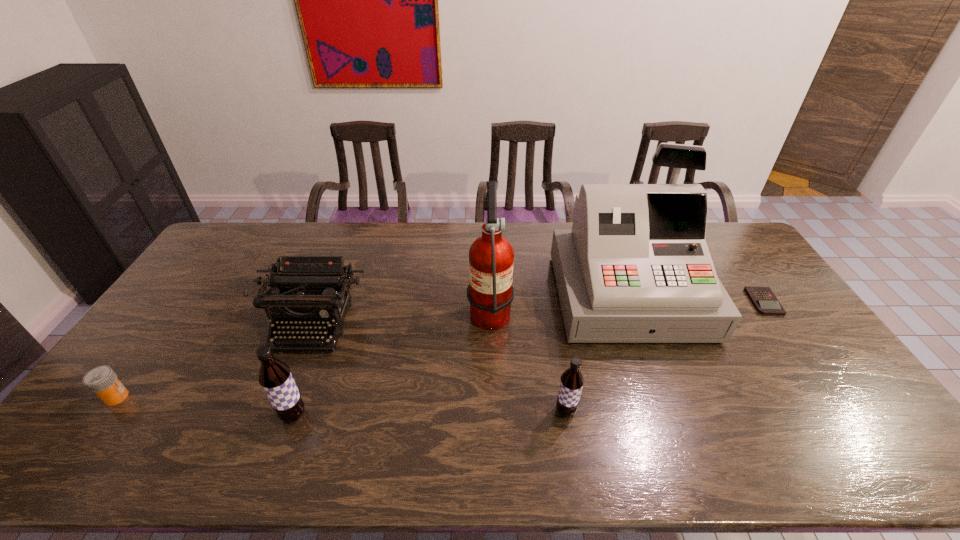
Locate an element on the screen. The height and width of the screenshot is (540, 960). object that stands as the fifth closest to the sixth object from left to right is located at coordinates (275, 377).

Identify which object is located as the nearest to the taller root beer. Please provide its 2D coordinates. Your answer should be formatted as a tuple, i.e. [(x, y)], where the tuple contains the x and y coordinates of a point satisfying the conditions above.

[(321, 283)]

Locate an element on the screen. This screenshot has height=540, width=960. vacant region that satisfies the following two spatial constraints: 1. on the keyboard of the right root beer; 2. on the right side of the typewriter is located at coordinates (279, 411).

Locate an element on the screen. The width and height of the screenshot is (960, 540). vacant space that satisfies the following two spatial constraints: 1. on the back side of the shortest object; 2. on the right side of the shorter root beer is located at coordinates (547, 302).

Find the location of a particular element. The image size is (960, 540). free location that satisfies the following two spatial constraints: 1. on the label side of the second shortest object; 2. on the back side of the third object from right to left is located at coordinates (107, 411).

I want to click on free location that satisfies the following two spatial constraints: 1. on the keyboard of the right root beer; 2. on the left side of the typewriter, so click(279, 411).

Locate an element on the screen. This screenshot has width=960, height=540. blank area in the image that satisfies the following two spatial constraints: 1. on the nozzle and handle of the shorter root beer; 2. on the right side of the fourth object from left to right is located at coordinates (492, 411).